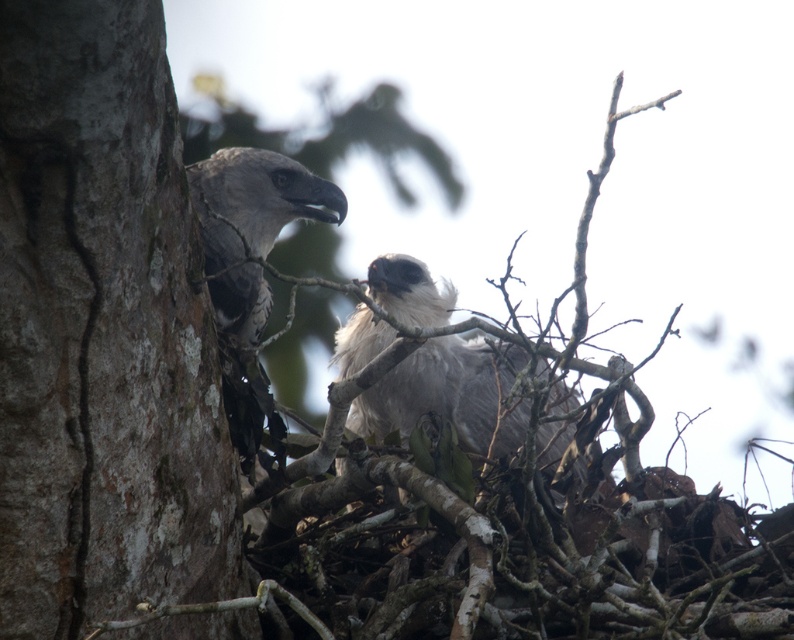
You are a birdwatcher observing the scene. You notice the rough bark tree trunk at left and the gray fluffy eagle at center. Which object is positioned to the left of the other?

The rough bark tree trunk at left is to the left of the gray fluffy eagle at center.

You are a birdwatcher observing the scene. You notice the rough bark tree trunk at left and the gray fluffy eagle at center. Which object is located higher in the image?

The rough bark tree trunk at left is positioned over the gray fluffy eagle at center, so it is higher in the image.

You are a birdwatcher observing the scene. You notice the rough bark tree trunk at left and the gray fluffy eagle at center. Which object is taller in the image?

The rough bark tree trunk at left is much taller than the gray fluffy eagle at center.